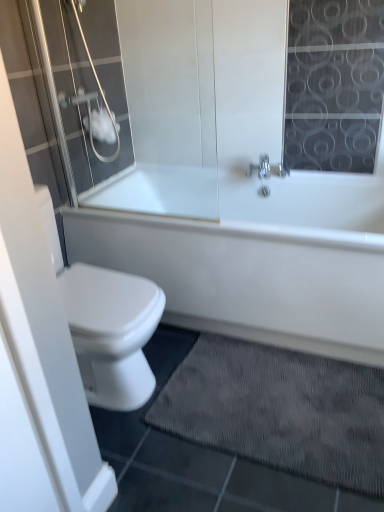
Where is `transparent glass shower door at upper left`? The image size is (384, 512). transparent glass shower door at upper left is located at coordinates (83, 81).

What do you see at coordinates (261, 260) in the screenshot?
I see `white glossy bathtub at center` at bounding box center [261, 260].

The width and height of the screenshot is (384, 512). Identify the location of dark gray textured bath mat at lower center. (279, 410).

In the image, is dark gray textured bath mat at lower center positioned in front of or behind transparent glass shower door at upper left?

Clearly, dark gray textured bath mat at lower center is in front of transparent glass shower door at upper left.

From the picture: From the image's perspective, is dark gray textured bath mat at lower center over transparent glass shower door at upper left?

No, from the image's perspective, dark gray textured bath mat at lower center is not above transparent glass shower door at upper left.

Based on the photo, would you say dark gray textured bath mat at lower center is to the left or to the right of transparent glass shower door at upper left in the picture?

Clearly, dark gray textured bath mat at lower center is on the right of transparent glass shower door at upper left in the image.

Is dark gray textured bath mat at lower center not near transparent glass shower door at upper left?

Yes.

Is transparent glass shower door at upper left inside white glossy bathtub at center?

No, transparent glass shower door at upper left is located outside of white glossy bathtub at center.

Does white glossy bathtub at center have a greater height compared to transparent glass shower door at upper left?

In fact, white glossy bathtub at center may be shorter than transparent glass shower door at upper left.

Which of these two, white glossy bathtub at center or transparent glass shower door at upper left, is bigger?

white glossy bathtub at center.

Does white glossy bathtub at center have a greater width compared to transparent glass shower door at upper left?

Yes.

Looking at this image, from a real-world perspective, is white glossy bathtub at center on top of white matte toilet paper at upper left?

No, from a real-world perspective, white glossy bathtub at center is not on top of white matte toilet paper at upper left.

Visually, is white glossy bathtub at center positioned to the left or to the right of white matte toilet paper at upper left?

Clearly, white glossy bathtub at center is on the right of white matte toilet paper at upper left in the image.

Considering the positions of point (147, 216) and point (97, 137), is point (147, 216) closer or farther from the camera than point (97, 137)?

Point (147, 216) is positioned closer to the camera compared to point (97, 137).

Is white matte toilet paper at upper left not near dark gray textured bath mat at lower center?

Yes.

Consider the image. Is white matte toilet paper at upper left inside or outside of dark gray textured bath mat at lower center?

white matte toilet paper at upper left lies outside dark gray textured bath mat at lower center.

Relative to dark gray textured bath mat at lower center, is white matte toilet paper at upper left in front or behind?

Clearly, white matte toilet paper at upper left is behind dark gray textured bath mat at lower center.

Which object is wider, transparent glass shower door at upper left or dark gray textured bath mat at lower center?

dark gray textured bath mat at lower center is wider.

Is transparent glass shower door at upper left next to dark gray textured bath mat at lower center and touching it?

No, transparent glass shower door at upper left is not with dark gray textured bath mat at lower center.

Can you confirm if transparent glass shower door at upper left is shorter than dark gray textured bath mat at lower center?

Incorrect, the height of transparent glass shower door at upper left does not fall short of that of dark gray textured bath mat at lower center.

Between white matte toilet paper at upper left and white glossy bathtub at center, which one is positioned in front?

Positioned in front is white glossy bathtub at center.

Which point is more forward, (115, 136) or (364, 187)?

Point (364, 187)

From a real-world perspective, which is physically below, white matte toilet paper at upper left or white glossy bathtub at center?

In real-world perspective, white glossy bathtub at center is lower.

The height and width of the screenshot is (512, 384). Find the location of `bathtub in front of the white matte toilet paper at upper left`. bathtub in front of the white matte toilet paper at upper left is located at coordinates (261, 260).

Between dark gray textured bath mat at lower center and white glossy bathtub at center, which one has smaller size?

Smaller between the two is dark gray textured bath mat at lower center.

From the image's perspective, is dark gray textured bath mat at lower center beneath white glossy bathtub at center?

Correct, dark gray textured bath mat at lower center appears lower than white glossy bathtub at center in the image.

Is dark gray textured bath mat at lower center positioned before white glossy bathtub at center?

Yes, dark gray textured bath mat at lower center is in front of white glossy bathtub at center.

Is dark gray textured bath mat at lower center facing away from white glossy bathtub at center?

dark gray textured bath mat at lower center does not have its back to white glossy bathtub at center.

Locate an element on the screen. The height and width of the screenshot is (512, 384). shower door to the left of dark gray textured bath mat at lower center is located at coordinates (83, 81).

This screenshot has height=512, width=384. Identify the location of bathtub on the right of transparent glass shower door at upper left. (261, 260).

From the picture: Considering their positions, is dark gray textured bath mat at lower center positioned further to white matte toilet paper at upper left than transparent glass shower door at upper left?

dark gray textured bath mat at lower center lies further to white matte toilet paper at upper left than the other object.

Based on their spatial positions, is dark gray textured bath mat at lower center or transparent glass shower door at upper left closer to white glossy bathtub at center?

dark gray textured bath mat at lower center.

In the scene shown: Which object lies further to the anchor point white glossy bathtub at center, white matte toilet paper at upper left or dark gray textured bath mat at lower center?

Among the two, white matte toilet paper at upper left is located further to white glossy bathtub at center.

Looking at the image, which one is located further to transparent glass shower door at upper left, white glossy bathtub at center or dark gray textured bath mat at lower center?

dark gray textured bath mat at lower center is further to transparent glass shower door at upper left.

Considering their positions, is transparent glass shower door at upper left positioned further to white matte toilet paper at upper left than dark gray textured bath mat at lower center?

dark gray textured bath mat at lower center lies further to white matte toilet paper at upper left than the other object.

Which object lies further to the anchor point dark gray textured bath mat at lower center, white glossy bathtub at center or transparent glass shower door at upper left?

The object further to dark gray textured bath mat at lower center is transparent glass shower door at upper left.

Estimate the real-world distances between objects in this image. Which object is further from dark gray textured bath mat at lower center, white matte toilet paper at upper left or transparent glass shower door at upper left?

Based on the image, white matte toilet paper at upper left appears to be further to dark gray textured bath mat at lower center.

Looking at this image, which object lies nearer to the anchor point dark gray textured bath mat at lower center, transparent glass shower door at upper left or white matte toilet paper at upper left?

Among the two, transparent glass shower door at upper left is located nearer to dark gray textured bath mat at lower center.

What are the coordinates of `toilet paper between transparent glass shower door at upper left and white glossy bathtub at center vertically` in the screenshot? It's located at (102, 126).

Find the location of a particular element. The width and height of the screenshot is (384, 512). bathtub between transparent glass shower door at upper left and dark gray textured bath mat at lower center vertically is located at coordinates (261, 260).

I want to click on bathtub that lies between white matte toilet paper at upper left and dark gray textured bath mat at lower center from top to bottom, so click(x=261, y=260).

The height and width of the screenshot is (512, 384). In order to click on toilet paper between transparent glass shower door at upper left and dark gray textured bath mat at lower center in the up-down direction in this screenshot , I will do [102, 126].